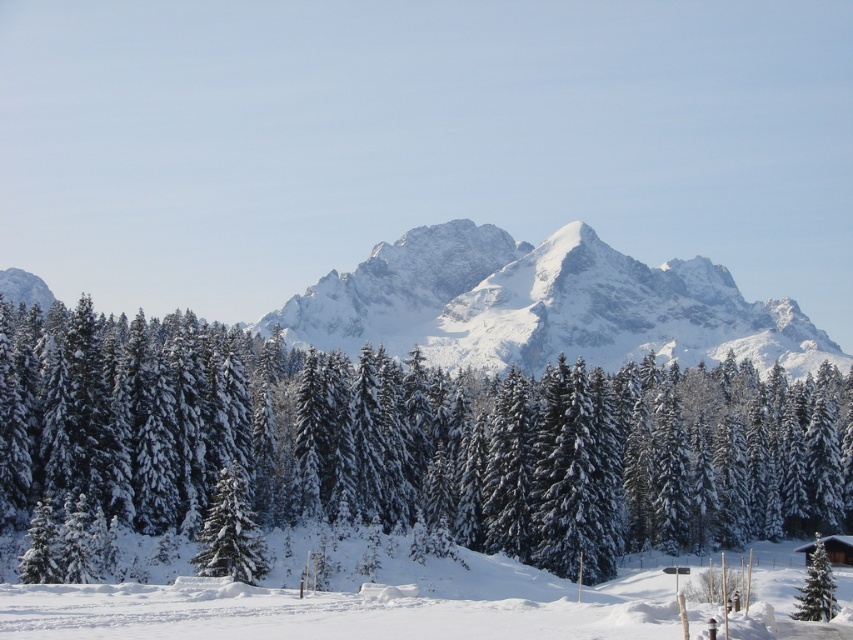
Question: Is snow-covered evergreen at center to the left of green matte tree at lower right from the viewer's perspective?

Choices:
 (A) yes
 (B) no

Answer: (A)

Question: Which object is closer to the camera taking this photo?

Choices:
 (A) white snow-covered mountain at center
 (B) snow-covered evergreen at center
 (C) green matte tree at center

Answer: (B)

Question: Which is nearer to the green matte tree at center?

Choices:
 (A) white snow-covered mountain at center
 (B) snow-covered evergreen at center
 (C) green matte tree at lower right

Answer: (B)

Question: Does white snow-covered mountain at center lie in front of green matte tree at center?

Choices:
 (A) no
 (B) yes

Answer: (A)

Question: Can you confirm if white snow ski slope at lower center is positioned to the left of green matte tree at center?

Choices:
 (A) no
 (B) yes

Answer: (A)

Question: Which is nearer to the white snow-covered mountain at center?

Choices:
 (A) snow-covered evergreen at center
 (B) white snow ski slope at lower center

Answer: (A)